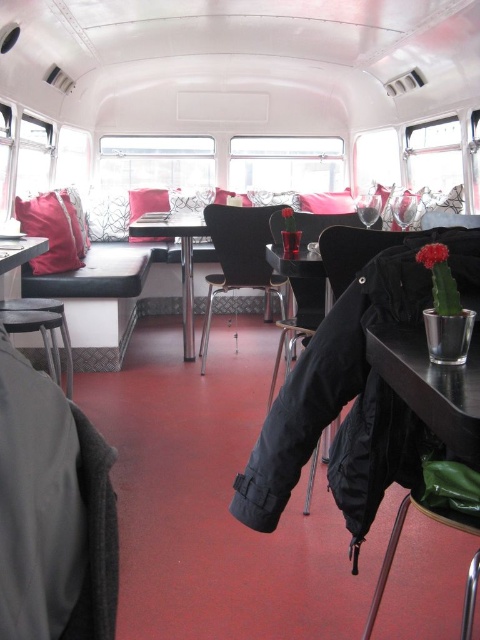
Does metallic silver table at lower right have a lesser width compared to metallic stool at lower left?

Yes.

Consider the image. Is metallic silver table at lower right bigger than metallic stool at lower left?

No, metallic silver table at lower right is not bigger than metallic stool at lower left.

Who is more distant from viewer, (407, 340) or (72, 355)?

Point (72, 355)

Where is `metallic silver table at lower right`? metallic silver table at lower right is located at coordinates (432, 385).

Who is positioned more to the right, clear glass window at center or matte black pillow at center?

clear glass window at center is more to the right.

Who is shorter, clear glass window at center or matte black pillow at center?

matte black pillow at center is shorter.

Does point (251, 157) come behind point (151, 202)?

Yes, point (251, 157) is farther from viewer.

I want to click on clear glass window at center, so click(287, 163).

Who is more distant from viewer, (453, 384) or (294, 349)?

The point (294, 349) is more distant.

Is metallic silver table at lower right in front of black leather chair at center?

Yes, metallic silver table at lower right is closer to the viewer.

You are a GUI agent. You are given a task and a screenshot of the screen. Output one action in this format:
    pyautogui.click(x=<x>, y=<y>)
    Task: Click on the metallic silver table at lower right
    Image resolution: width=480 pixels, height=640 pixels.
    Given the screenshot: What is the action you would take?
    [x=432, y=385]